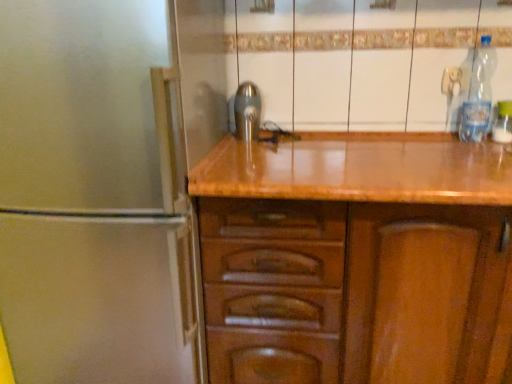
Question: Is polished metallic tap at center facing towards clear plastic bottle at upper right, the second bottle from the right?

Choices:
 (A) no
 (B) yes

Answer: (A)

Question: Is polished metallic tap at center behind clear plastic bottle at upper right, which ranks as the 1th bottle in left-to-right order?

Choices:
 (A) yes
 (B) no

Answer: (A)

Question: Considering the relative sizes of polished metallic tap at center and clear plastic bottle at upper right, the second bottle from the right, in the image provided, is polished metallic tap at center smaller than clear plastic bottle at upper right, the second bottle from the right,?

Choices:
 (A) no
 (B) yes

Answer: (B)

Question: Considering the relative positions of polished metallic tap at center and clear plastic bottle at upper right, which ranks as the 1th bottle in left-to-right order, in the image provided, is polished metallic tap at center to the left of clear plastic bottle at upper right, which ranks as the 1th bottle in left-to-right order, from the viewer's perspective?

Choices:
 (A) yes
 (B) no

Answer: (A)

Question: Is polished metallic tap at center completely or partially outside of clear plastic bottle at upper right, the second bottle from the right?

Choices:
 (A) no
 (B) yes

Answer: (B)

Question: Based on their positions, is clear plastic bottle at upper right, which ranks as the 1th bottle in left-to-right order, located to the left or right of polished metallic tap at center?

Choices:
 (A) left
 (B) right

Answer: (B)

Question: In terms of height, does clear plastic bottle at upper right, the second bottle from the right, look taller or shorter compared to polished metallic tap at center?

Choices:
 (A) tall
 (B) short

Answer: (A)

Question: In terms of size, does clear plastic bottle at upper right, the second bottle from the right, appear bigger or smaller than polished metallic tap at center?

Choices:
 (A) small
 (B) big

Answer: (B)

Question: From the image's perspective, is clear plastic bottle at upper right, which ranks as the 1th bottle in left-to-right order, positioned above or below polished metallic tap at center?

Choices:
 (A) above
 (B) below

Answer: (A)

Question: In the image, is clear plastic bottle at right, the 2th bottle positioned from the left, on the left side or the right side of polished metallic tap at center?

Choices:
 (A) right
 (B) left

Answer: (A)

Question: Does point (501, 109) appear closer or farther from the camera than point (256, 109)?

Choices:
 (A) farther
 (B) closer

Answer: (B)

Question: Is clear plastic bottle at right, the 2th bottle positioned from the left, bigger or smaller than polished metallic tap at center?

Choices:
 (A) big
 (B) small

Answer: (B)

Question: From a real-world perspective, relative to polished metallic tap at center, is clear plastic bottle at right, which is counted as the 1th bottle, starting from the right, vertically above or below?

Choices:
 (A) above
 (B) below

Answer: (B)

Question: Is clear plastic bottle at upper right, which ranks as the 1th bottle in left-to-right order, situated inside clear plastic bottle at right, the 2th bottle positioned from the left, or outside?

Choices:
 (A) outside
 (B) inside

Answer: (A)

Question: Considering the relative positions of clear plastic bottle at upper right, the second bottle from the right, and clear plastic bottle at right, which is counted as the 1th bottle, starting from the right, in the image provided, is clear plastic bottle at upper right, the second bottle from the right, to the left or to the right of clear plastic bottle at right, which is counted as the 1th bottle, starting from the right,?

Choices:
 (A) left
 (B) right

Answer: (A)